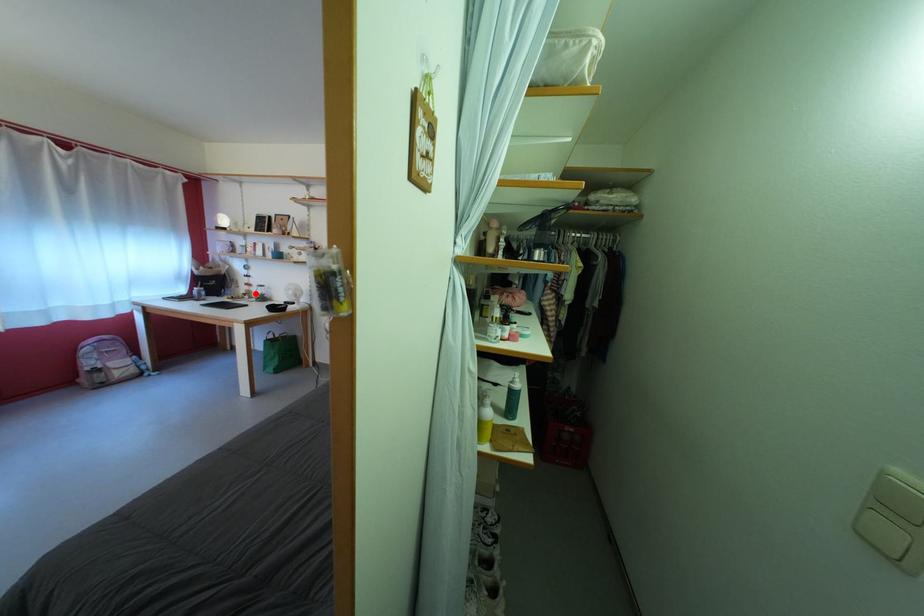
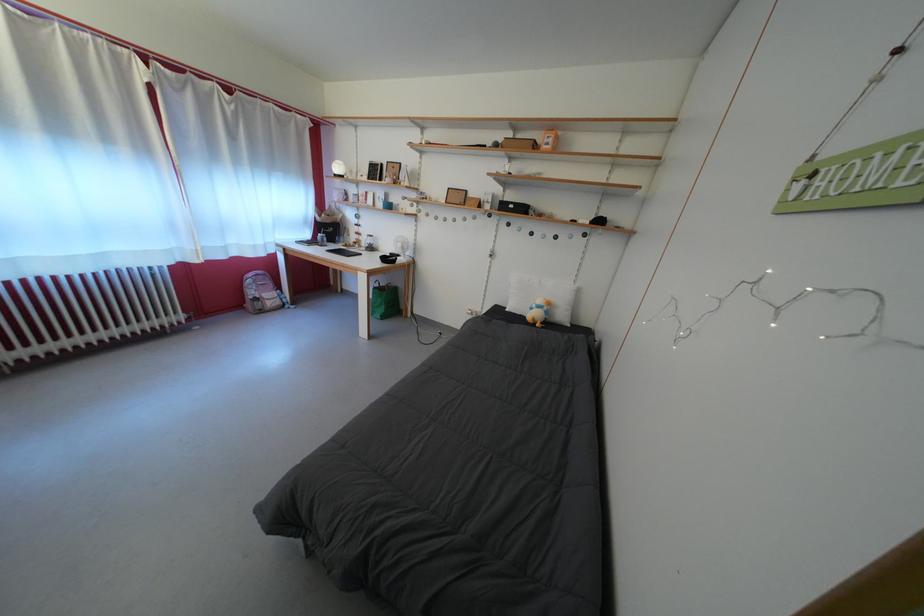
Question: I am providing you with two images of the same scene from different viewpoints. Given a red point in image1, look at the same physical point in image2. Is it:

Choices:
 (A) Closer to the viewpoint
 (B) Farther from the viewpoint

Answer: (A)